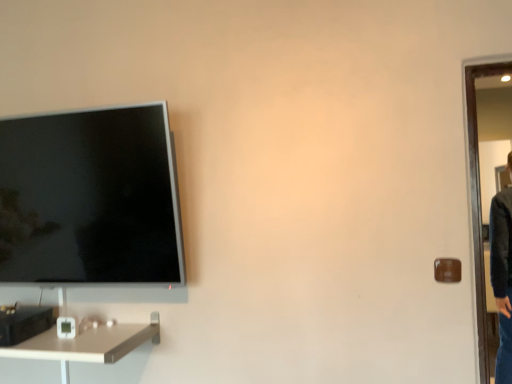
Question: Is white glossy desk at lower left directly adjacent to brown matte door handle at right?

Choices:
 (A) yes
 (B) no

Answer: (B)

Question: Are white glossy desk at lower left and brown matte door handle at right far apart?

Choices:
 (A) yes
 (B) no

Answer: (A)

Question: From a real-world perspective, is white glossy desk at lower left over brown matte door handle at right?

Choices:
 (A) no
 (B) yes

Answer: (A)

Question: Can you confirm if white glossy desk at lower left is smaller than brown matte door handle at right?

Choices:
 (A) yes
 (B) no

Answer: (B)

Question: Is brown matte door handle at right located within white glossy desk at lower left?

Choices:
 (A) no
 (B) yes

Answer: (A)

Question: Is white glossy desk at lower left further to the viewer compared to brown matte door handle at right?

Choices:
 (A) yes
 (B) no

Answer: (B)

Question: Is white glossy desk at lower left at the back of brown matte door handle at right?

Choices:
 (A) yes
 (B) no

Answer: (B)

Question: Is the depth of brown matte door handle at right less than that of white glossy desk at lower left?

Choices:
 (A) yes
 (B) no

Answer: (B)

Question: From the image's perspective, is brown matte door handle at right below white glossy desk at lower left?

Choices:
 (A) yes
 (B) no

Answer: (B)

Question: From a real-world perspective, is brown matte door handle at right located beneath white glossy desk at lower left?

Choices:
 (A) no
 (B) yes

Answer: (A)

Question: Does brown matte door handle at right have a lesser height compared to white glossy desk at lower left?

Choices:
 (A) yes
 (B) no

Answer: (B)

Question: From a real-world perspective, is brown matte door handle at right over white glossy desk at lower left?

Choices:
 (A) yes
 (B) no

Answer: (A)

Question: Looking at their shapes, would you say brown matte door handle at right is wider or thinner than white glossy desk at lower left?

Choices:
 (A) thin
 (B) wide

Answer: (A)